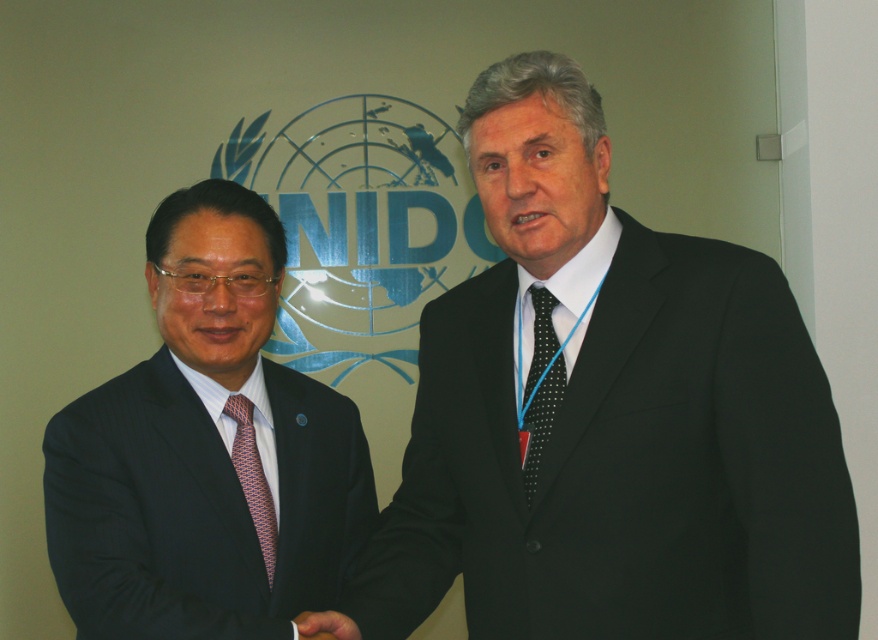
You are a photographer standing at a certain distance from the scene. You want to take a closeup photo of the black dotted tie at center without including any other objects in the frame. Is the distance you are currently at suitable for this?

The black dotted tie at center is 1.40 meters away from camera. To take a closeup photo, you would need to be closer than 1.40 meters or use a zoom lens to capture the tie without including other objects.

You are a photographer at the UNIDO event and need to capture a photo where both the dark blue pinstripe suit at left and the black dotted tie at center are clearly visible. Based on their positions, can you ensure that both elements will be in the frame without moving the camera?

The dark blue pinstripe suit at left is located below the black dotted tie at center, so as long as the camera frame includes both the lower and upper areas where these elements are positioned, both will be visible without moving the camera.

You are a photographer at the UNIDO event. You need to capture a closeup shot of the black dotted tie at center and the smooth skin hand at center. The camera you are using has a minimum focusing distance of 40 centimeters. Can you take the photo without moving either object?

The black dotted tie at center and smooth skin hand at center are 39.55 centimeters apart. Since the minimum focusing distance is 40 centimeters, the camera cannot focus on both objects simultaneously without moving them closer.